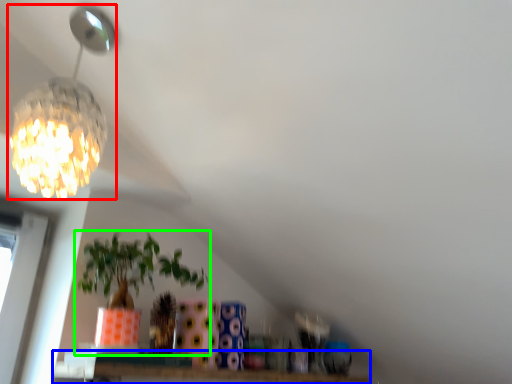
Question: Which object is the closest to the lamp (highlighted by a red box)? Choose among these: window (highlighted by a blue box) or houseplant (highlighted by a green box).

Choices:
 (A) window
 (B) houseplant

Answer: (B)